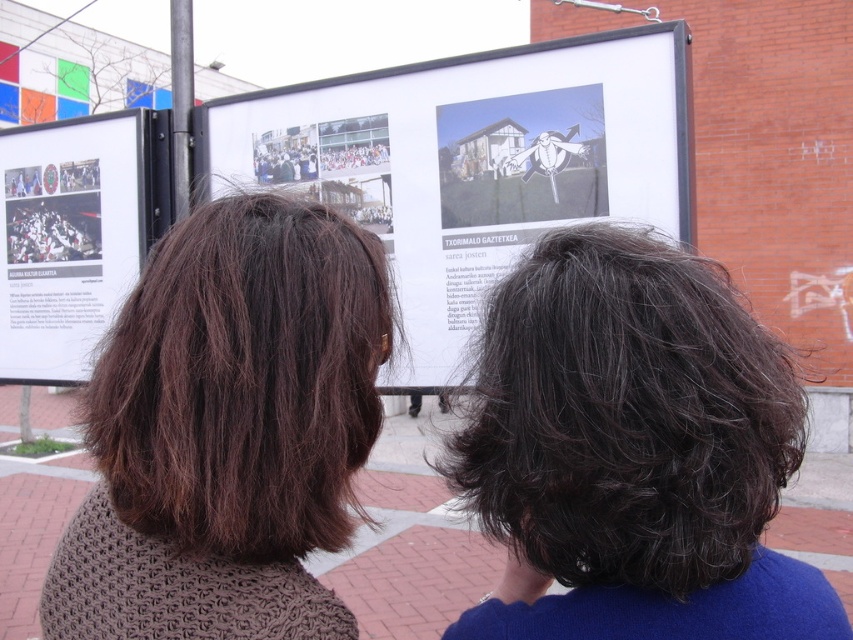
You are a photographer trying to capture a clear shot of the white glossy poster at center without any obstruction. Given that the dark brown curly hair at center is blocking part of the poster, can you estimate whether the obstruction is minimal or significant based on their sizes?

The dark brown curly hair at center is smaller than the white glossy poster at center, so the obstruction caused by the dark brown curly hair at center would be minimal.